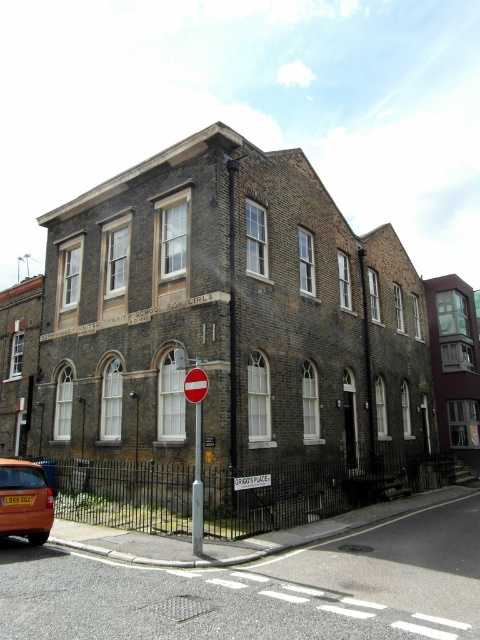
Question: Estimate the real-world distances between objects in this image. Which object is farther from the metallic pole at center?

Choices:
 (A) white plastic sign at center
 (B) red plastic stop sign at center

Answer: (A)

Question: Does orange matte car at lower left appear on the right side of white plastic sign at center?

Choices:
 (A) yes
 (B) no

Answer: (B)

Question: Which object is the farthest from the orange matte car at lower left?

Choices:
 (A) metallic pole at center
 (B) red plastic stop sign at center
 (C) white plastic sign at center

Answer: (C)

Question: Is metallic pole at center above white plastic sign at center?

Choices:
 (A) no
 (B) yes

Answer: (B)

Question: Does orange matte car at lower left have a smaller size compared to red plastic stop sign at center?

Choices:
 (A) no
 (B) yes

Answer: (A)

Question: Which point is farther to the camera?

Choices:
 (A) (189, 397)
 (B) (201, 432)
 (C) (28, 492)
 (D) (269, 476)

Answer: (D)